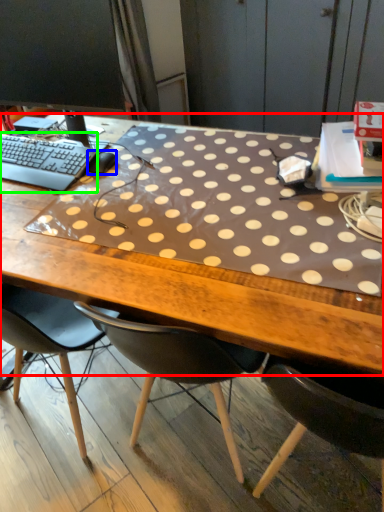
Question: Considering the real-world distances, which object is closest to desk (highlighted by a red box)? mouse (highlighted by a blue box) or computer keyboard (highlighted by a green box).

Choices:
 (A) mouse
 (B) computer keyboard

Answer: (B)